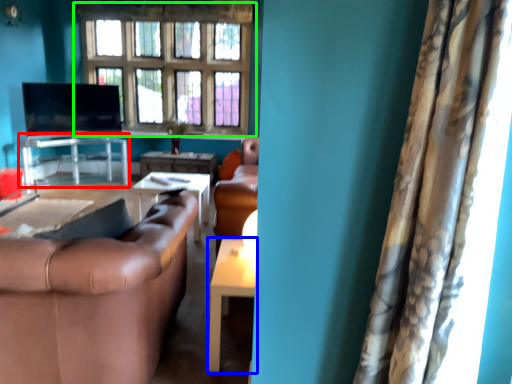
Question: Which object is positioned closest to table (highlighted by a red box)? Select from table (highlighted by a blue box) and window (highlighted by a green box).

Choices:
 (A) table
 (B) window

Answer: (B)